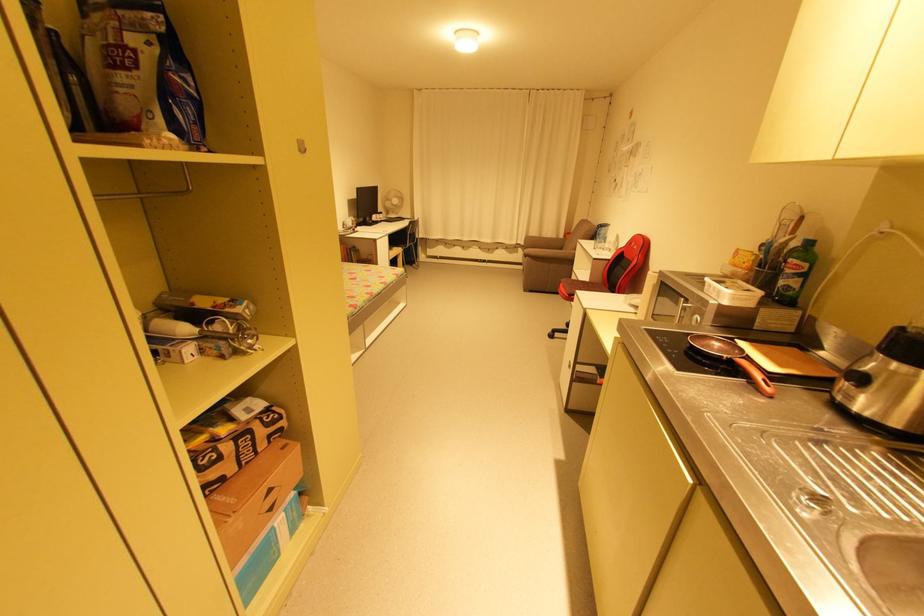
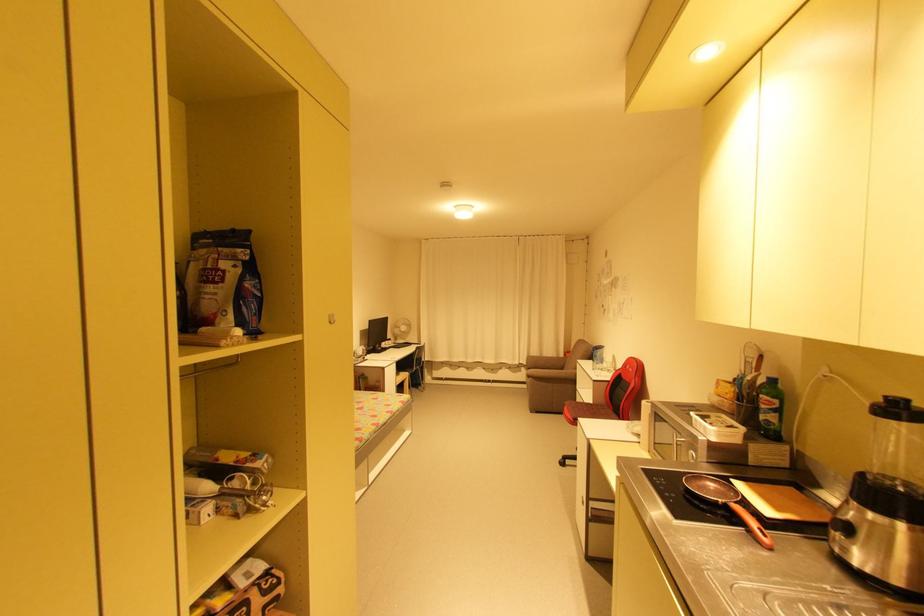
Locate, in the second image, the point that corresponds to point (752, 383) in the first image.

(751, 532)